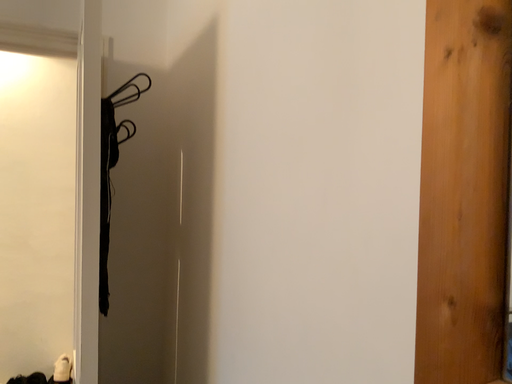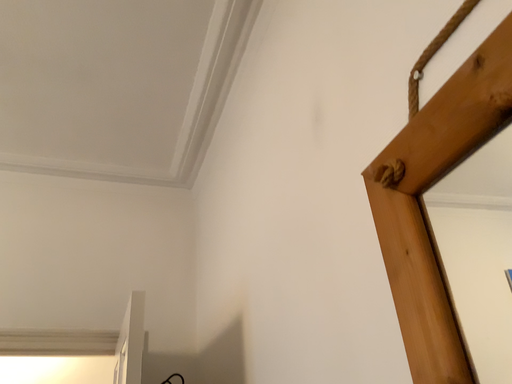
Question: How did the camera likely rotate when shooting the video?

Choices:
 (A) rotated upward
 (B) rotated downward

Answer: (A)